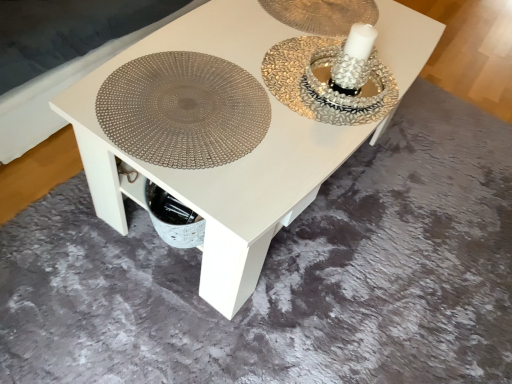
Question: Would you say white glossy table at center is inside or outside matte silver platter at center?

Choices:
 (A) inside
 (B) outside

Answer: (B)

Question: From the image's perspective, is white glossy table at center above or below matte silver platter at center?

Choices:
 (A) above
 (B) below

Answer: (A)

Question: Based on their positions, is white glossy table at center located to the left or right of matte silver platter at center?

Choices:
 (A) right
 (B) left

Answer: (A)

Question: From the image's perspective, is matte silver platter at center positioned above or below white glossy table at center?

Choices:
 (A) above
 (B) below

Answer: (B)

Question: Is matte silver platter at center in front of or behind white glossy table at center in the image?

Choices:
 (A) behind
 (B) front

Answer: (A)

Question: Visually, is matte silver platter at center positioned to the left or to the right of white glossy table at center?

Choices:
 (A) left
 (B) right

Answer: (A)

Question: Considering the positions of matte silver platter at center and white glossy table at center in the image, is matte silver platter at center wider or thinner than white glossy table at center?

Choices:
 (A) thin
 (B) wide

Answer: (A)